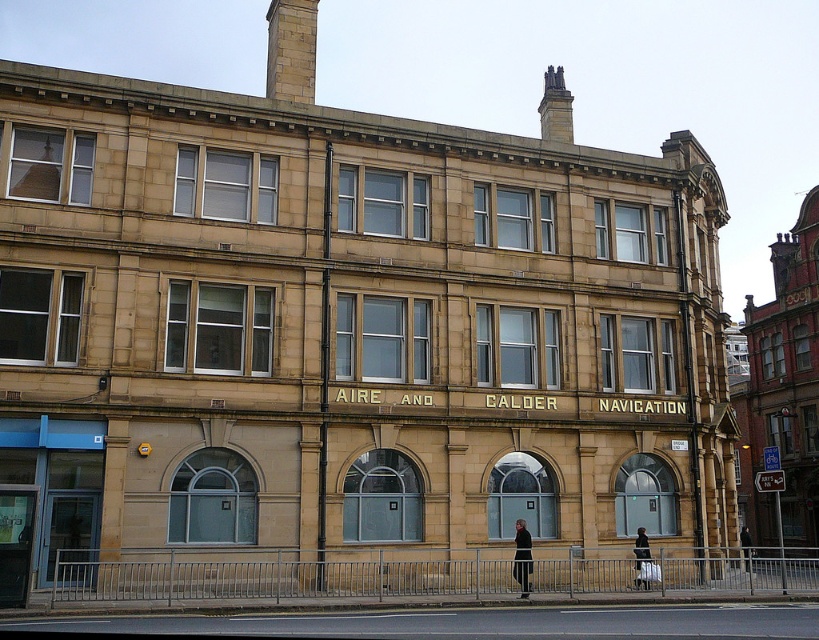
Between white fabric bag at center and dark gray jacket at center, which one has more height?

Standing taller between the two is dark gray jacket at center.

Can you confirm if white fabric bag at center is positioned below dark gray jacket at center?

Actually, white fabric bag at center is above dark gray jacket at center.

Between point (643, 557) and point (741, 532), which one is positioned behind?

The point (741, 532) is more distant.

Find the location of `white fabric bag at center`. white fabric bag at center is located at coordinates (641, 547).

Can you confirm if black fabric at center is smaller than dark gray jacket at center?

Yes, black fabric at center is smaller than dark gray jacket at center.

Does point (528, 556) come farther from viewer compared to point (749, 532)?

No, it is in front of (749, 532).

Where is `black fabric at center`? This screenshot has width=819, height=640. black fabric at center is located at coordinates (523, 557).

Who is taller, black fabric at center or white fabric bag at center?

Standing taller between the two is black fabric at center.

Which is below, black fabric at center or white fabric bag at center?

white fabric bag at center is lower down.

In order to click on black fabric at center in this screenshot , I will do `click(523, 557)`.